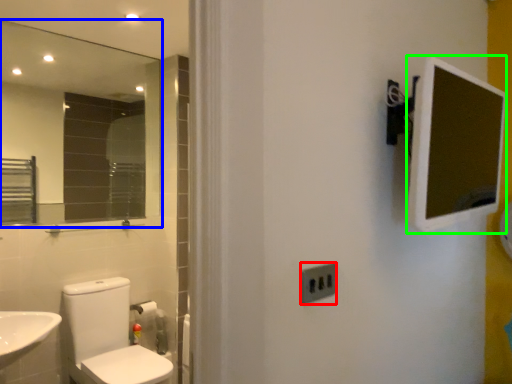
Question: Considering the real-world distances, which object is closest to electric outlet (highlighted by a red box)? mirror (highlighted by a blue box) or medicine cabinet (highlighted by a green box).

Choices:
 (A) mirror
 (B) medicine cabinet

Answer: (B)